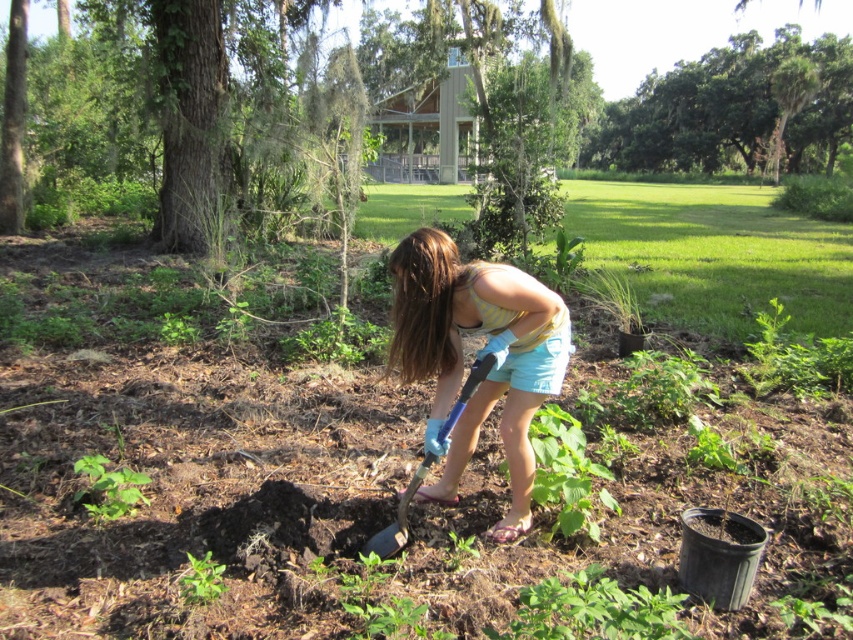
Can you confirm if green leafy tree at upper center is positioned above green leafy weed at lower left?

Yes.

Who is taller, green leafy tree at upper center or green leafy weed at lower left?

green leafy tree at upper center is taller.

Measure the distance between point (706, 129) and camera.

75.27 meters

Find the location of a particular element. The image size is (853, 640). green leafy tree at upper center is located at coordinates (728, 109).

Which is in front, point (473, 368) or point (213, 570)?

Positioned in front is point (213, 570).

Who is taller, blue plastic shovel at center or green leafy weed at lower left?

With more height is blue plastic shovel at center.

Locate an element on the screen. The image size is (853, 640). blue plastic shovel at center is located at coordinates (398, 516).

Which of these two, matte blue gloves at center or green leafy weed at lower left, stands shorter?

green leafy weed at lower left is shorter.

Can you confirm if matte blue gloves at center is positioned to the left of green leafy weed at lower left?

In fact, matte blue gloves at center is to the right of green leafy weed at lower left.

Describe the element at coordinates (477, 355) in the screenshot. I see `matte blue gloves at center` at that location.

Locate an element on the screen. The height and width of the screenshot is (640, 853). matte blue gloves at center is located at coordinates (477, 355).